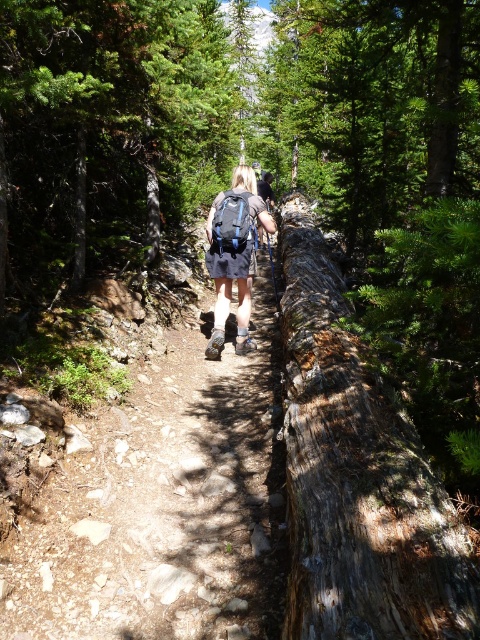
Question: Which point is closer to the camera?

Choices:
 (A) (227, 296)
 (B) (223, 241)

Answer: (B)

Question: Which of the following is the farthest from the observer?

Choices:
 (A) matte black backpack at center
 (B) brown dirt trail at center

Answer: (A)

Question: Can you confirm if brown dirt trail at center is positioned to the right of matte black backpack at center?

Choices:
 (A) yes
 (B) no

Answer: (B)

Question: Estimate the real-world distances between objects in this image. Which object is farther from the matte blue backpack at center?

Choices:
 (A) matte black backpack at center
 (B) brown dirt trail at center

Answer: (B)

Question: Considering the relative positions of brown dirt trail at center and matte blue backpack at center in the image provided, where is brown dirt trail at center located with respect to matte blue backpack at center?

Choices:
 (A) above
 (B) below

Answer: (B)

Question: Is the position of brown dirt trail at center more distant than that of matte black backpack at center?

Choices:
 (A) yes
 (B) no

Answer: (B)